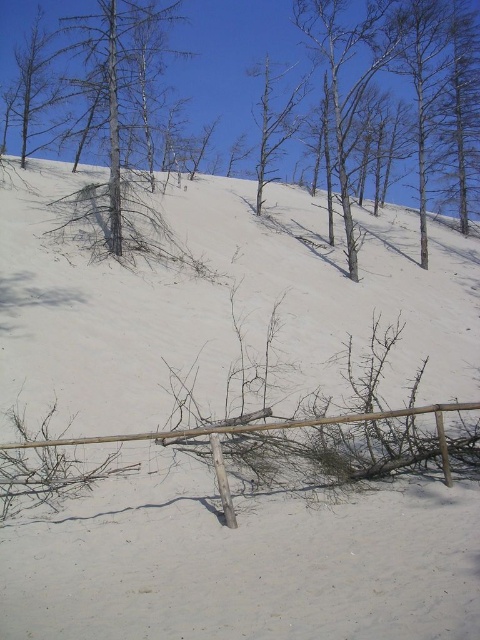
Question: Which object is positioned farthest from the gray bark tree at upper left?

Choices:
 (A) brown wood fence at lower center
 (B) dead wood at center
 (C) bare wood tree at center

Answer: (A)

Question: Can you confirm if dead wood at center is positioned above gray bark tree at upper left?

Choices:
 (A) no
 (B) yes

Answer: (B)

Question: Which object is closer to the camera taking this photo?

Choices:
 (A) dead wood at center
 (B) brown wood fence at lower center
 (C) gray bark tree at upper left
 (D) bare wood tree at center

Answer: (B)

Question: Which object appears closest to the camera in this image?

Choices:
 (A) brown wood fence at lower center
 (B) dead wood at center

Answer: (A)

Question: Can you confirm if dead wood at center is bigger than bare wood tree at center?

Choices:
 (A) yes
 (B) no

Answer: (A)

Question: Can you confirm if dead wood at center is thinner than bare wood tree at center?

Choices:
 (A) yes
 (B) no

Answer: (B)